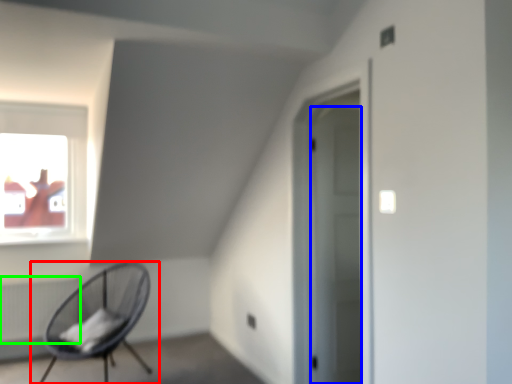
Question: Which is nearer to the chair (highlighted by a red box)? door (highlighted by a blue box) or radiator (highlighted by a green box).

Choices:
 (A) door
 (B) radiator

Answer: (B)